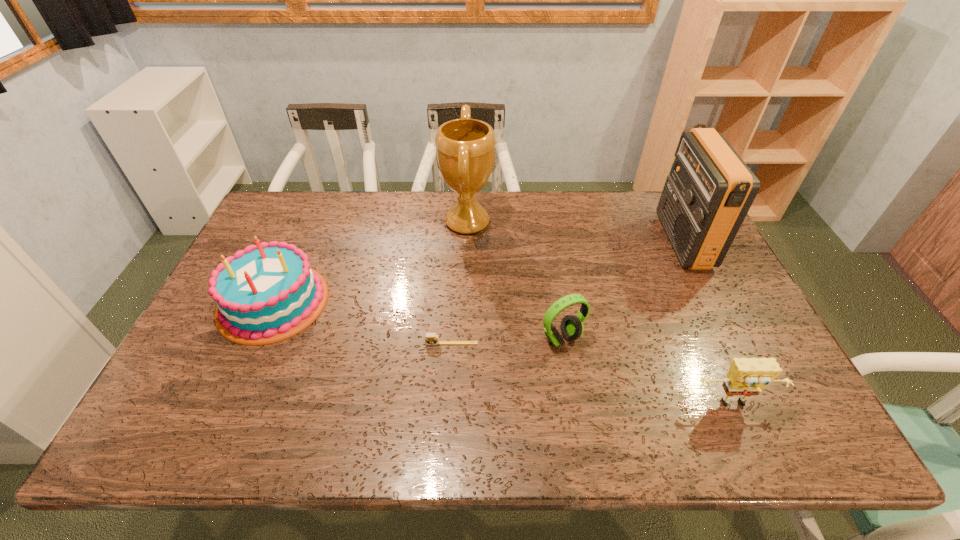
Find the location of a particular element. The height and width of the screenshot is (540, 960). free space that satisfies the following two spatial constraints: 1. on the front-facing side of the radio receiver; 2. at the front of the shortest object with the tape extended is located at coordinates (733, 343).

The width and height of the screenshot is (960, 540). I want to click on free point that satisfies the following two spatial constraints: 1. on the front-facing side of the radio receiver; 2. at the front of the tape measure with the tape extended, so click(733, 343).

Image resolution: width=960 pixels, height=540 pixels. What are the coordinates of `blank space that satisfies the following two spatial constraints: 1. on the back side of the headset; 2. on the front of the award with the decoration` in the screenshot? It's located at tap(543, 222).

Locate an element on the screen. The width and height of the screenshot is (960, 540). vacant region that satisfies the following two spatial constraints: 1. on the front-facing side of the radio receiver; 2. on the front side of the birthday cake is located at coordinates (713, 302).

At what (x,y) coordinates should I click in order to perform the action: click on free spot that satisfies the following two spatial constraints: 1. on the front-facing side of the radio receiver; 2. at the front of the tape measure with the tape extended. Please return your answer as a coordinate pair (x, y). Image resolution: width=960 pixels, height=540 pixels. Looking at the image, I should click on [x=733, y=343].